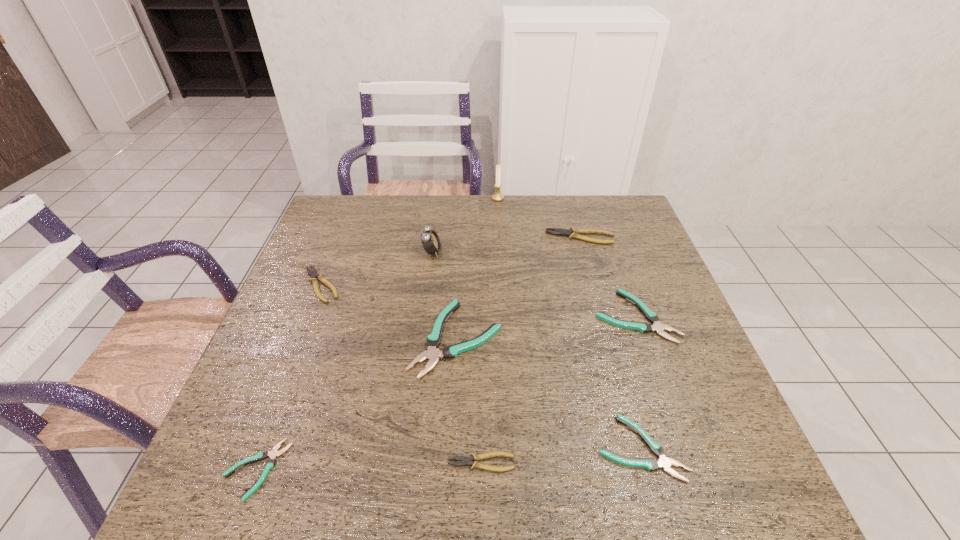
Find the location of a particular element. The height and width of the screenshot is (540, 960). free space located on the back of the second smallest yellow pliers is located at coordinates (351, 207).

Where is `vacant space located on the left of the second smallest teal pliers`? vacant space located on the left of the second smallest teal pliers is located at coordinates (465, 448).

Locate an element on the screen. Image resolution: width=960 pixels, height=540 pixels. vacant space located 0.320m on the right of the second yellow pliers from right to left is located at coordinates (682, 463).

Find the location of a particular element. The image size is (960, 540). vacant position located on the back of the smallest teal pliers is located at coordinates (307, 335).

At what (x,y) coordinates should I click in order to perform the action: click on candle holder that is at the far edge. Please return your answer as a coordinate pair (x, y). This screenshot has width=960, height=540. Looking at the image, I should click on pos(497,196).

Locate an element on the screen. The image size is (960, 540). pliers at the far edge is located at coordinates (572, 233).

This screenshot has height=540, width=960. I want to click on object that is at the near left corner, so click(x=274, y=452).

You are a GUI agent. You are given a task and a screenshot of the screen. Output one action in this format:
    pyautogui.click(x=<x>, y=<y>)
    Task: Click on the object positioned at the far right corner
    The width and height of the screenshot is (960, 540).
    Given the screenshot: What is the action you would take?
    pyautogui.click(x=572, y=233)

At what (x,y) coordinates should I click in order to perform the action: click on object that is at the near right corner. Please return your answer as a coordinate pair (x, y). The width and height of the screenshot is (960, 540). Looking at the image, I should click on (650, 464).

Image resolution: width=960 pixels, height=540 pixels. In order to click on vacant region at the far edge of the desktop in this screenshot , I will do `click(588, 228)`.